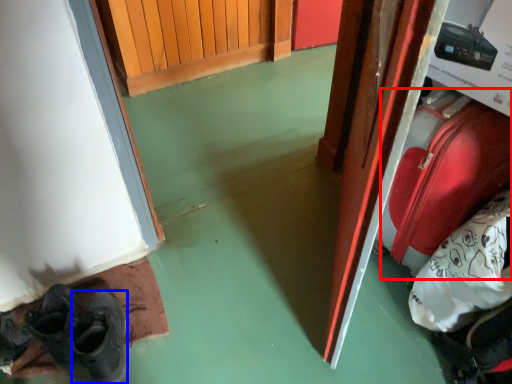
Question: Which object is further to the camera taking this photo, luggage (highlighted by a red box) or shoe (highlighted by a blue box)?

Choices:
 (A) luggage
 (B) shoe

Answer: (B)